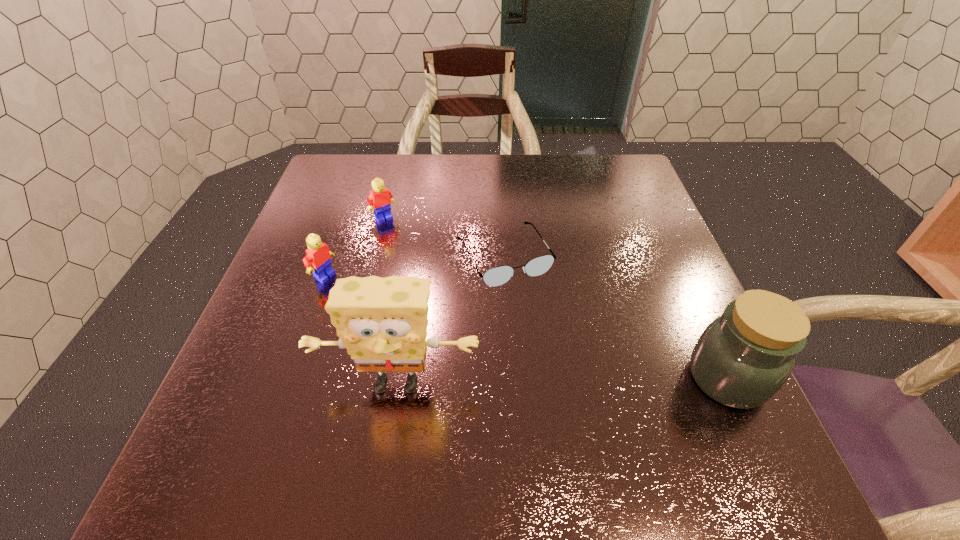
This screenshot has width=960, height=540. Find the location of `sponge situated at the left edge`. sponge situated at the left edge is located at coordinates (382, 322).

The image size is (960, 540). In order to click on Lego that is at the left edge in this screenshot , I will do `click(318, 256)`.

The height and width of the screenshot is (540, 960). In order to click on object located at the right edge in this screenshot , I will do `click(741, 360)`.

I want to click on object that is positioned at the near left corner, so click(x=382, y=322).

Where is `object located in the near right corner section of the desktop`? object located in the near right corner section of the desktop is located at coordinates coord(741,360).

Where is `vacant space at the far edge`? Image resolution: width=960 pixels, height=540 pixels. vacant space at the far edge is located at coordinates (421, 164).

I want to click on free space at the near edge, so click(x=449, y=399).

Locate an element on the screen. This screenshot has height=540, width=960. vacant point at the left edge is located at coordinates (334, 262).

Find the location of a particular element. This screenshot has width=960, height=540. vacant position at the right edge of the desktop is located at coordinates (639, 240).

The image size is (960, 540). Find the location of `vacant space at the far left corner of the desktop`. vacant space at the far left corner of the desktop is located at coordinates (364, 159).